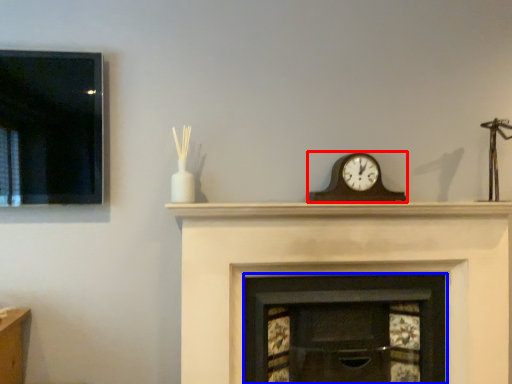
Question: Among these objects, which one is nearest to the camera, wall clock (highlighted by a red box) or fireplace (highlighted by a blue box)?

Choices:
 (A) wall clock
 (B) fireplace

Answer: (B)